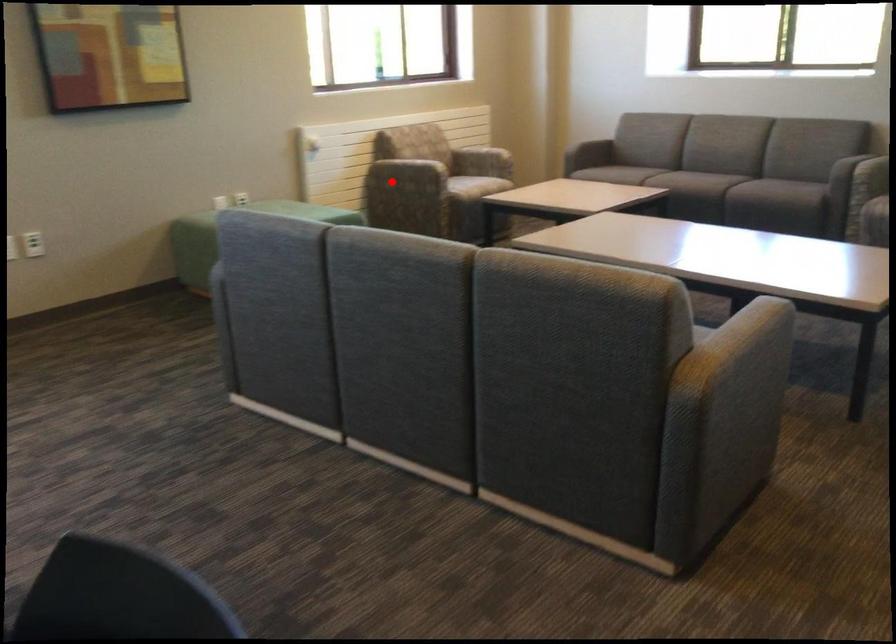
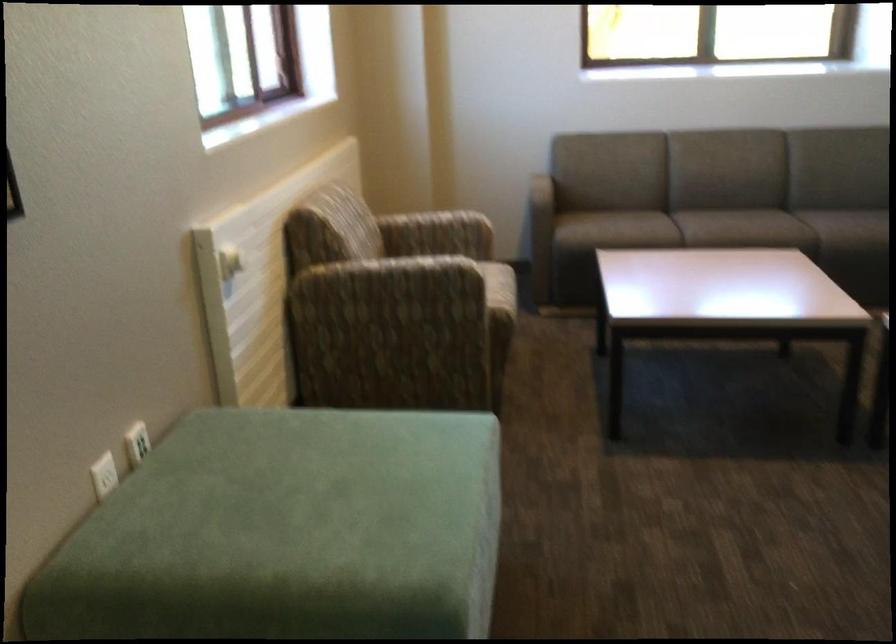
Question: I am providing you with two images of the same scene from different viewpoints. A red point is shown in image1. For the corresponding object point in image2, is it positioned nearer or farther from the camera?

Choices:
 (A) Nearer
 (B) Farther

Answer: (A)